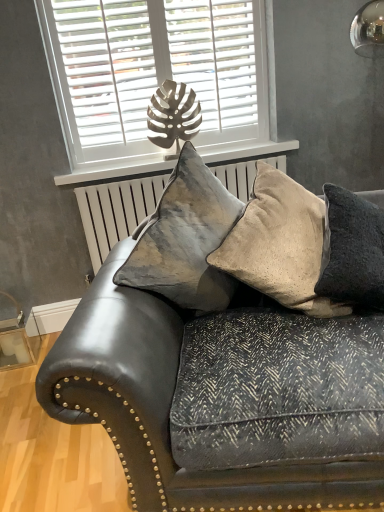
Question: From a real-world perspective, does leather couch at center sit lower than white matte window at upper center?

Choices:
 (A) yes
 (B) no

Answer: (A)

Question: Can you confirm if leather couch at center is positioned to the right of white matte window at upper center?

Choices:
 (A) yes
 (B) no

Answer: (A)

Question: Considering the relative sizes of leather couch at center and white matte window at upper center in the image provided, is leather couch at center smaller than white matte window at upper center?

Choices:
 (A) yes
 (B) no

Answer: (B)

Question: Is leather couch at center bigger than white matte window at upper center?

Choices:
 (A) yes
 (B) no

Answer: (A)

Question: Can you confirm if leather couch at center is shorter than white matte window at upper center?

Choices:
 (A) yes
 (B) no

Answer: (A)

Question: From the image's perspective, is leather couch at center on white matte window at upper center?

Choices:
 (A) yes
 (B) no

Answer: (B)

Question: Is velvet cushion at center, which appears as the 3th pillow when viewed from the right, positioned beyond the bounds of white matte window sill at upper center?

Choices:
 (A) no
 (B) yes

Answer: (B)

Question: Does velvet cushion at center, which appears as the 3th pillow when viewed from the right, lie in front of white matte window sill at upper center?

Choices:
 (A) yes
 (B) no

Answer: (A)

Question: Can you confirm if velvet cushion at center, positioned as the 1th pillow in left-to-right order, is positioned to the right of white matte window sill at upper center?

Choices:
 (A) no
 (B) yes

Answer: (B)

Question: From a real-world perspective, is velvet cushion at center, which appears as the 3th pillow when viewed from the right, positioned over white matte window sill at upper center based on gravity?

Choices:
 (A) no
 (B) yes

Answer: (A)

Question: Could you tell me if velvet cushion at center, which appears as the 3th pillow when viewed from the right, is turned towards white matte window sill at upper center?

Choices:
 (A) yes
 (B) no

Answer: (B)

Question: Does velvet cushion at center, which appears as the 3th pillow when viewed from the right, have a greater height compared to white matte window sill at upper center?

Choices:
 (A) yes
 (B) no

Answer: (A)

Question: Is leather couch at center outside of white matte window sill at upper center?

Choices:
 (A) yes
 (B) no

Answer: (A)